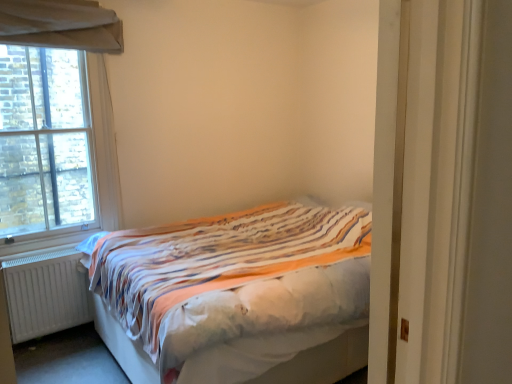
Question: Is white matte radiator at lower left facing towards striped fabric bed at center?

Choices:
 (A) yes
 (B) no

Answer: (B)

Question: Is white matte radiator at lower left not within striped fabric bed at center?

Choices:
 (A) yes
 (B) no

Answer: (A)

Question: From the image's perspective, is white matte radiator at lower left on striped fabric bed at center?

Choices:
 (A) no
 (B) yes

Answer: (A)

Question: Can you confirm if white matte radiator at lower left is shorter than striped fabric bed at center?

Choices:
 (A) yes
 (B) no

Answer: (A)

Question: From a real-world perspective, is white matte radiator at lower left located higher than striped fabric bed at center?

Choices:
 (A) yes
 (B) no

Answer: (B)

Question: Is point (27, 175) positioned closer to the camera than point (308, 339)?

Choices:
 (A) farther
 (B) closer

Answer: (A)

Question: From the image's perspective, is brick textured window at left above or below striped fabric bed at center?

Choices:
 (A) below
 (B) above

Answer: (B)

Question: Relative to striped fabric bed at center, is brick textured window at left in front or behind?

Choices:
 (A) front
 (B) behind

Answer: (B)

Question: Considering the relative positions of brick textured window at left and striped fabric bed at center in the image provided, is brick textured window at left to the left or to the right of striped fabric bed at center?

Choices:
 (A) left
 (B) right

Answer: (A)

Question: Considering the positions of white wooden door at right and white matte radiator at lower left in the image, is white wooden door at right taller or shorter than white matte radiator at lower left?

Choices:
 (A) tall
 (B) short

Answer: (A)

Question: Considering the positions of white wooden door at right and white matte radiator at lower left in the image, is white wooden door at right wider or thinner than white matte radiator at lower left?

Choices:
 (A) wide
 (B) thin

Answer: (A)

Question: Is point (415, 6) closer or farther from the camera than point (60, 281)?

Choices:
 (A) closer
 (B) farther

Answer: (A)

Question: From a real-world perspective, is white wooden door at right above or below white matte radiator at lower left?

Choices:
 (A) above
 (B) below

Answer: (A)

Question: From their relative heights in the image, would you say white matte radiator at lower left is taller or shorter than striped fabric bed at center?

Choices:
 (A) tall
 (B) short

Answer: (B)

Question: Based on their sizes in the image, would you say white matte radiator at lower left is bigger or smaller than striped fabric bed at center?

Choices:
 (A) big
 (B) small

Answer: (B)